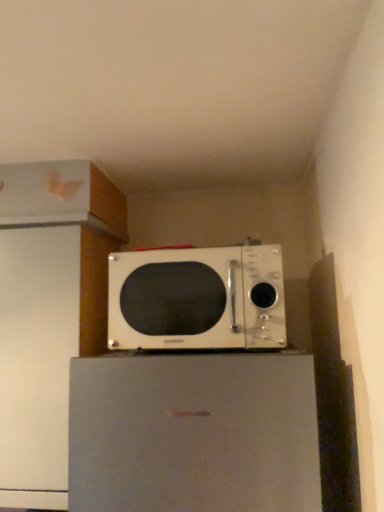
Question: Would you say white glossy microwave at center is inside or outside white matte refrigerator at center?

Choices:
 (A) inside
 (B) outside

Answer: (B)

Question: Considering the relative positions of white glossy microwave at center and white matte refrigerator at center in the image provided, is white glossy microwave at center to the left or to the right of white matte refrigerator at center?

Choices:
 (A) left
 (B) right

Answer: (A)

Question: Considering the positions of white glossy microwave at center and white matte refrigerator at center in the image, is white glossy microwave at center wider or thinner than white matte refrigerator at center?

Choices:
 (A) thin
 (B) wide

Answer: (A)

Question: From a real-world perspective, relative to white glossy microwave at center, is white matte refrigerator at center vertically above or below?

Choices:
 (A) above
 (B) below

Answer: (B)

Question: From the image's perspective, is white matte refrigerator at center above or below white glossy microwave at center?

Choices:
 (A) below
 (B) above

Answer: (A)

Question: Would you say white matte refrigerator at center is to the left or to the right of white glossy microwave at center in the picture?

Choices:
 (A) right
 (B) left

Answer: (A)

Question: Is white matte refrigerator at center taller or shorter than white glossy microwave at center?

Choices:
 (A) short
 (B) tall

Answer: (B)